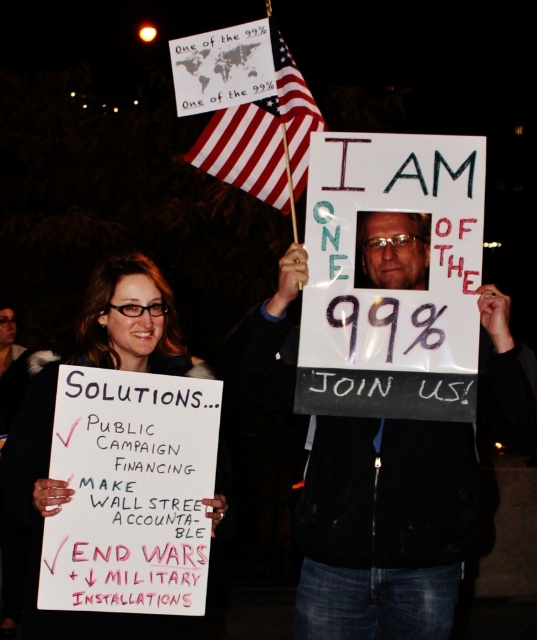
You are a photographer standing in the protest scene. You want to take a photo of the woman holding the sign and the point at (415, 600). Can you fit both subjects in your camera frame if your camera has a maximum focus range of 3 meters?

The point at (415, 600) is 3.54 meters from the viewer, which is beyond the camera maximum focus range of 3 meters. Therefore, you cannot fit both subjects in your camera frame.

Looking at the nighttime protest scene, where is the matte white sign at center in relation to the american flag at upper center?

The matte white sign at center is to the left of the american flag at upper center.

What is the relationship in width between the matte white sign at center and the american flag at upper center?

The matte white sign at center is wider than the american flag at upper center according to the description.